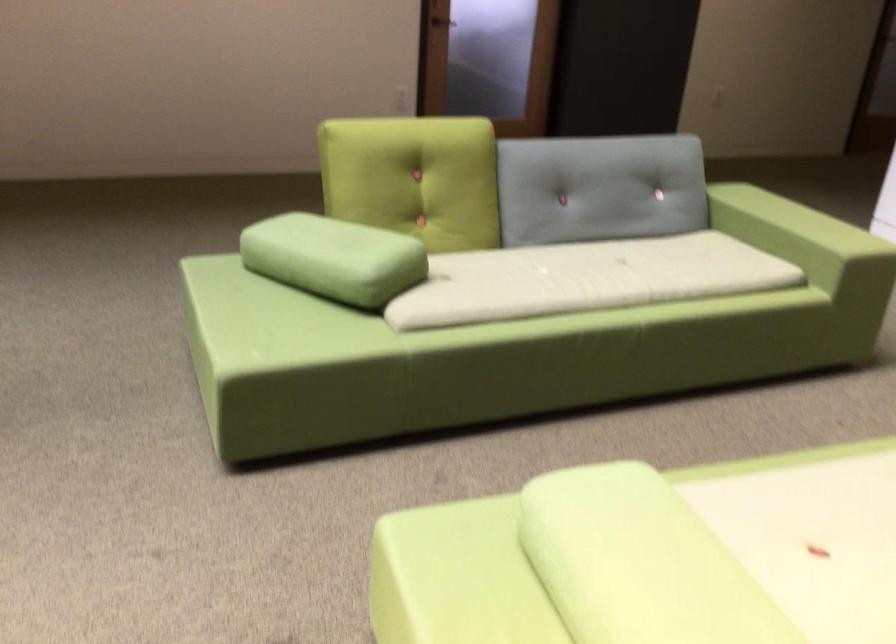
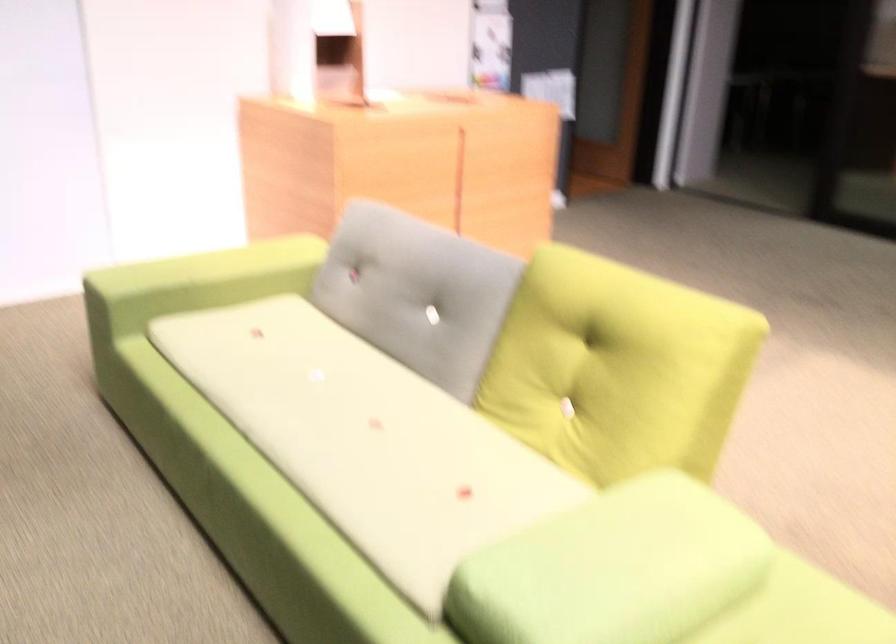
Where in the second image is the point corresponding to point 600,526 from the first image?

(613, 569)